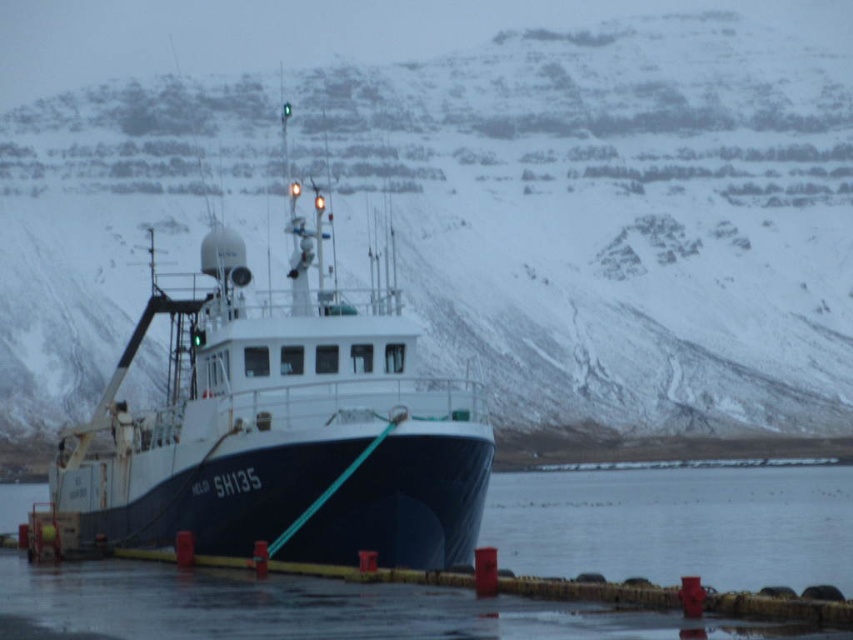
You are a dock worker checking the safety of the boat and the water. Based on the scene, which object is bigger in size between the dark blue matte boat at center and the black rubber water at lower center?

The dark blue matte boat at center has a larger size compared to the black rubber water at lower center, so the dark blue matte boat at center is bigger.

You are a photographer planning to capture a wide shot of the dark blue matte boat at center and the snowy rock formation at upper center. Based on their sizes, which object should you focus on first to ensure both are in frame?

The snowy rock formation at upper center might be wider than the dark blue matte boat at center, so focusing on the snowy rock formation at upper center first would ensure both are in frame.

You are standing on the pier looking at the fishing boat HELGI SH135. There are two points marked on the boat. The first point is at coordinates point [740,154] and the second is at point [213,625]. Which point is closer to you?

Point [740,154] is closer to you because it is further to the viewer than point [213,625].